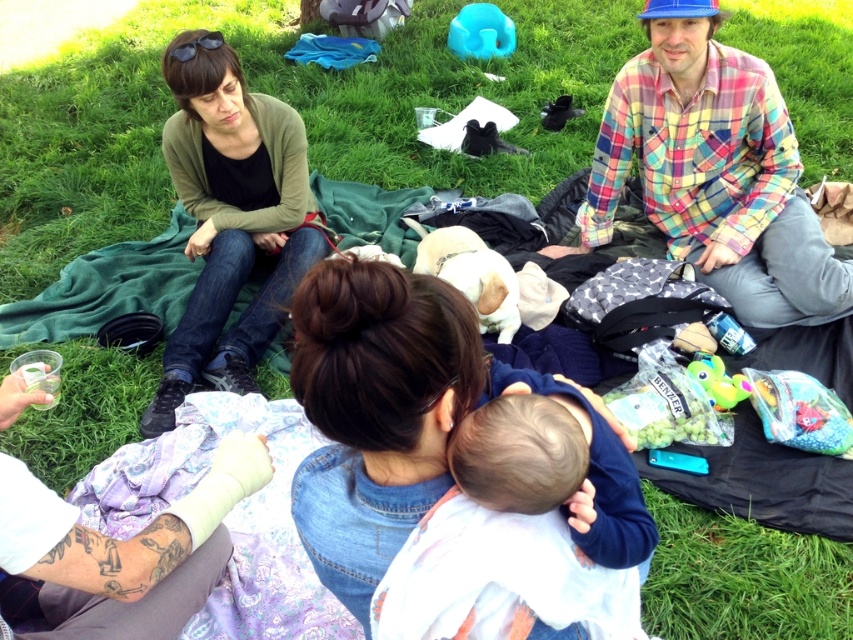
You are a photographer taking a picture of the scene. You notice the green matte cardigan at upper left and the white bandaged arm at lower left. Which object should you focus on first to ensure both are in sharp focus?

The green matte cardigan at upper left is closer to the viewer than the white bandaged arm at lower left. To ensure both are in sharp focus, focus on the green matte cardigan at upper left first since it is closer, and the depth of field may naturally include the farther object.

You are a photographer trying to capture a photo of the brown denim jacket at center and the multicolored plaid shirt at upper right. Which object should you focus on first to ensure both are in the frame without moving the camera?

The brown denim jacket at center is in front of the multicolored plaid shirt at upper right, so you should focus on the brown denim jacket at center first to ensure both are in the frame without moving the camera.

You are taking a photo of the scene and want to focus on both point (164, 380) and point (91, 532). Which point is closer to your camera?

Point (164, 380) is further to the camera than point (91, 532), so the point closer to your camera is point (91, 532).